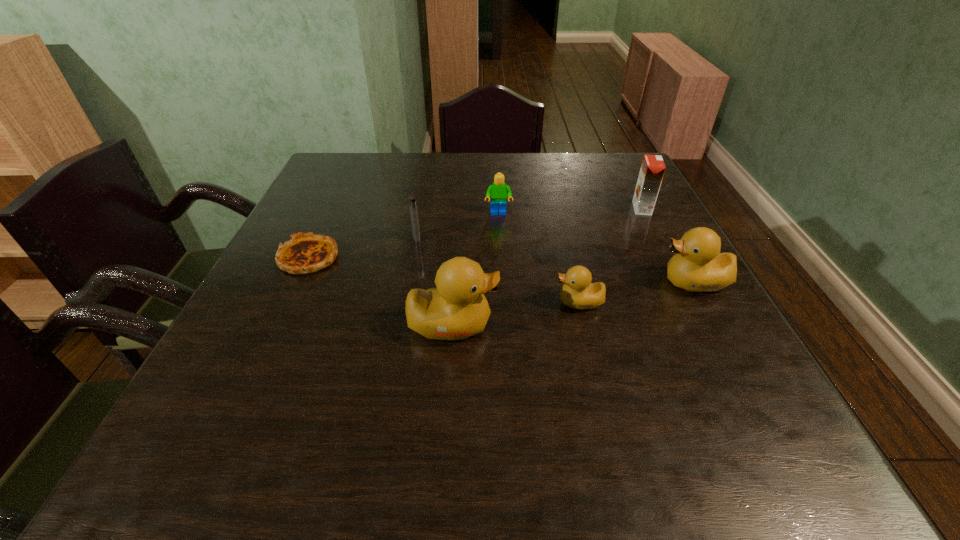
Identify the location of object positioned at the left edge. This screenshot has height=540, width=960. (305, 253).

At what (x,y) coordinates should I click in order to perform the action: click on duckling that is at the right edge. Please return your answer as a coordinate pair (x, y). Looking at the image, I should click on pos(698,266).

Find the location of a particular element. The width and height of the screenshot is (960, 540). orange juice at the right edge is located at coordinates (652, 169).

Find the location of a particular element. The width and height of the screenshot is (960, 540). vacant region at the far edge of the desktop is located at coordinates (451, 178).

Identify the location of free space at the near edge of the desktop. (304, 400).

Locate an element on the screen. This screenshot has width=960, height=540. vacant region at the left edge is located at coordinates (305, 286).

Where is `free point at the right edge`? free point at the right edge is located at coordinates (656, 225).

In the image, there is a desktop. At what (x,y) coordinates should I click in order to perform the action: click on vacant area at the far right corner. Please return your answer as a coordinate pair (x, y). Image resolution: width=960 pixels, height=540 pixels. Looking at the image, I should click on (595, 185).

This screenshot has width=960, height=540. Find the location of `vacant area that lies between the leftmost object and the orange juice`. vacant area that lies between the leftmost object and the orange juice is located at coordinates (475, 233).

Locate an element on the screen. The image size is (960, 540). vacant area between the leftmost duckling and the second duckling from right to left is located at coordinates (516, 313).